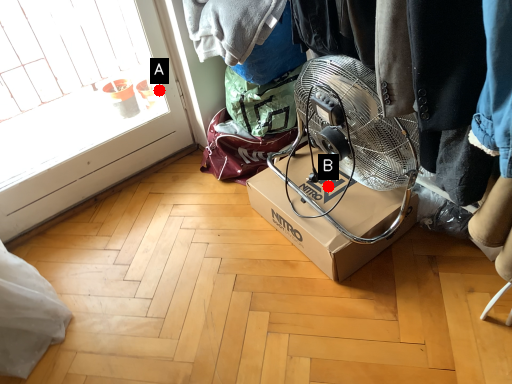
Question: Two points are circled on the image, labeled by A and B beside each circle. Which point is closer to the camera?

Choices:
 (A) A is closer
 (B) B is closer

Answer: (B)